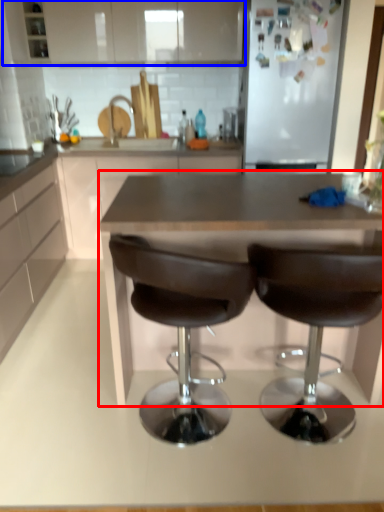
Question: Among these objects, which one is farthest to the camera, table (highlighted by a red box) or cabinetry (highlighted by a blue box)?

Choices:
 (A) table
 (B) cabinetry

Answer: (B)